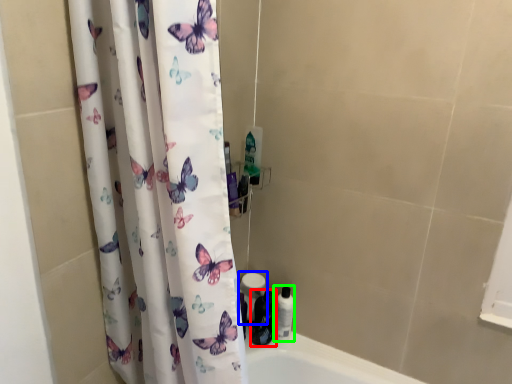
Question: Which object is the farthest from toiletry (highlighted by a red box)? Choose among these: toilet paper (highlighted by a blue box) or toiletry (highlighted by a green box).

Choices:
 (A) toilet paper
 (B) toiletry

Answer: (A)